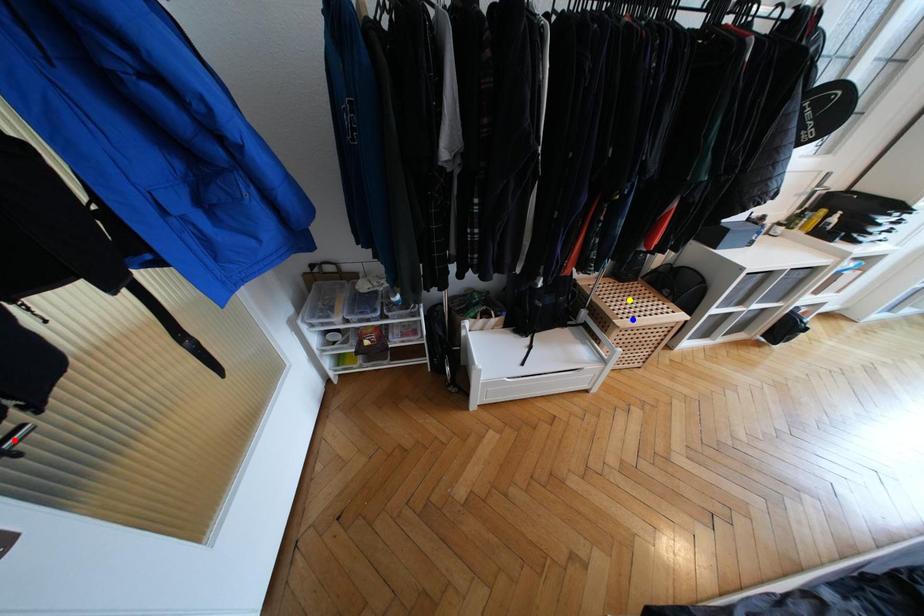
Order these from farthest to nearest:
blue point
red point
yellow point

yellow point → blue point → red point